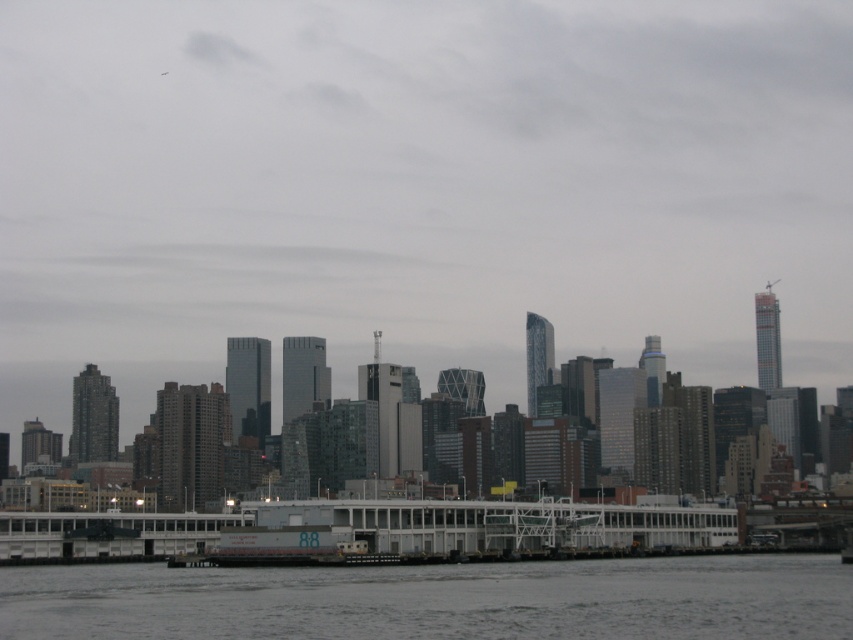
You are a delivery person who needs to cross the gray concrete river at lower center to reach the white matte boat at center. Is the boat accessible from the river?

The gray concrete river at lower center is located below the white matte boat at center, so yes, the boat is accessible via the river.

You are a delivery person needing to cross the gray concrete river at lower center to reach the white matte boat at center. The boat is your destination. Given that your vehicle can only navigate paths wider than 25 meters, can you safely drive across the river to the boat?

The distance between the gray concrete river at lower center and the white matte boat at center is 24.63 meters. Since your vehicle requires a path wider than 25 meters, you cannot safely drive across the river to the boat as the distance is insufficient.